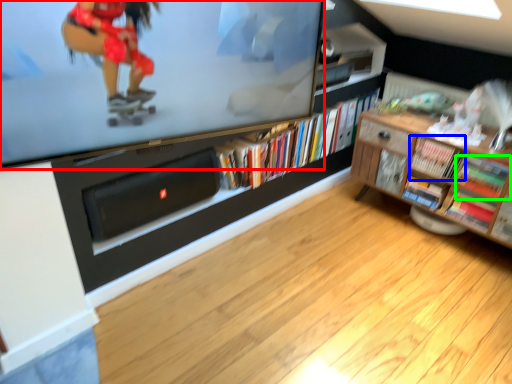
Question: Based on their relative distances, which object is farther from television (highlighted by a red box)? Choose from book (highlighted by a blue box) and book (highlighted by a green box).

Choices:
 (A) book
 (B) book

Answer: (B)